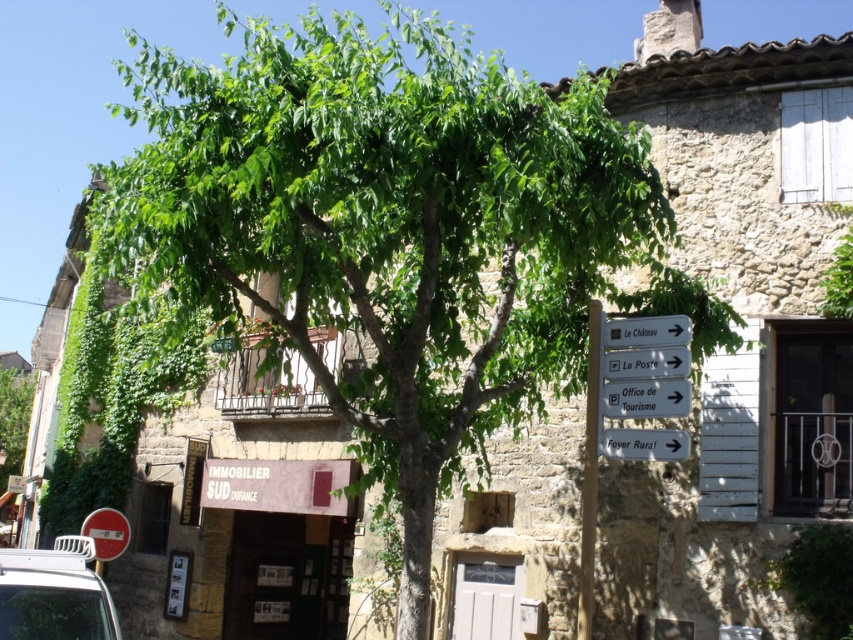
Between white plastic signpost at center and metallic circular sign at lower left, which one appears on the left side from the viewer's perspective?

Positioned to the left is metallic circular sign at lower left.

Describe the element at coordinates (646, 364) in the screenshot. The image size is (853, 640). I see `white plastic signpost at center` at that location.

Who is more forward, [660,348] or [106,524]?

Point [660,348] is more forward.

The height and width of the screenshot is (640, 853). Find the location of `white plastic signpost at center`. white plastic signpost at center is located at coordinates (646, 364).

This screenshot has width=853, height=640. Describe the element at coordinates (54, 593) in the screenshot. I see `white matte car at lower left` at that location.

In the scene shown: Is white matte car at lower left shorter than white plastic signpost at center?

No, white matte car at lower left is not shorter than white plastic signpost at center.

Is point (90, 632) more distant than point (656, 355)?

No, (90, 632) is closer to viewer.

The height and width of the screenshot is (640, 853). Identify the location of white matte car at lower left. (54, 593).

Who is lower down, green leafy tree at center or white plastic signpost at center?

green leafy tree at center is below.

Identify the location of green leafy tree at center. The height and width of the screenshot is (640, 853). (13, 419).